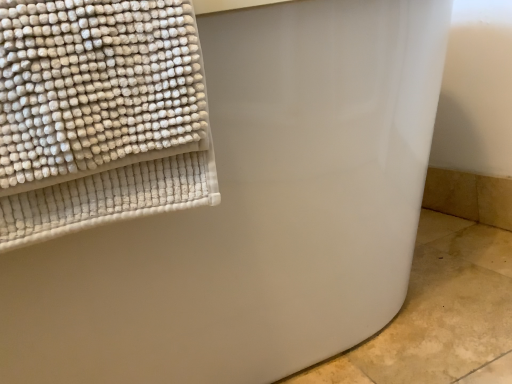
Describe the element at coordinates (99, 115) in the screenshot. The width and height of the screenshot is (512, 384). I see `white textured bath towel at upper left` at that location.

Where is `white textured bath towel at upper left`? white textured bath towel at upper left is located at coordinates (99, 115).

This screenshot has width=512, height=384. Identify the location of white textured bath towel at upper left. (99, 115).